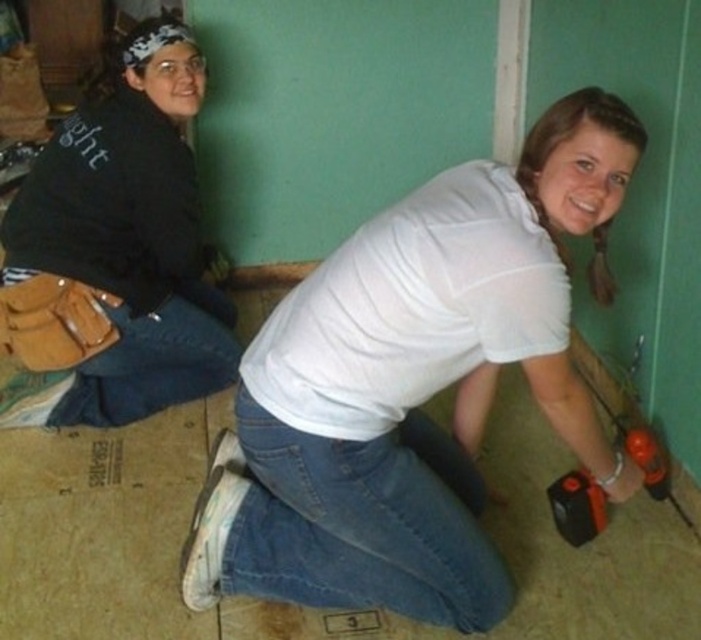
Question: Which object appears farthest from the camera in this image?

Choices:
 (A) white matte shirt at center
 (B) black matte jacket at upper left

Answer: (B)

Question: Is white matte shirt at center thinner than black matte jacket at upper left?

Choices:
 (A) no
 (B) yes

Answer: (A)

Question: Is white matte shirt at center below black matte jacket at upper left?

Choices:
 (A) no
 (B) yes

Answer: (B)

Question: Which point is closer to the camera?

Choices:
 (A) (601, 248)
 (B) (46, 257)

Answer: (A)

Question: Does white matte shirt at center come behind black matte jacket at upper left?

Choices:
 (A) yes
 (B) no

Answer: (B)